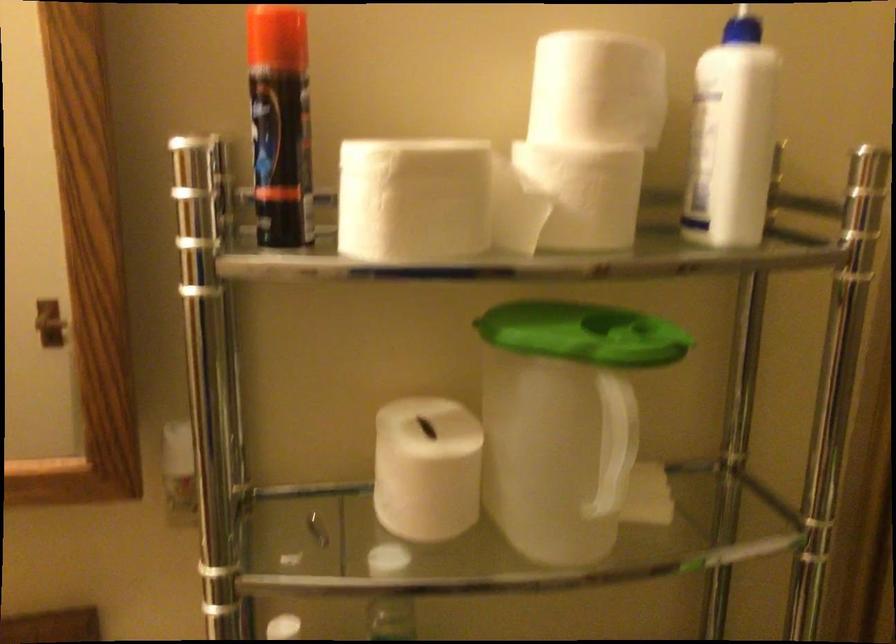
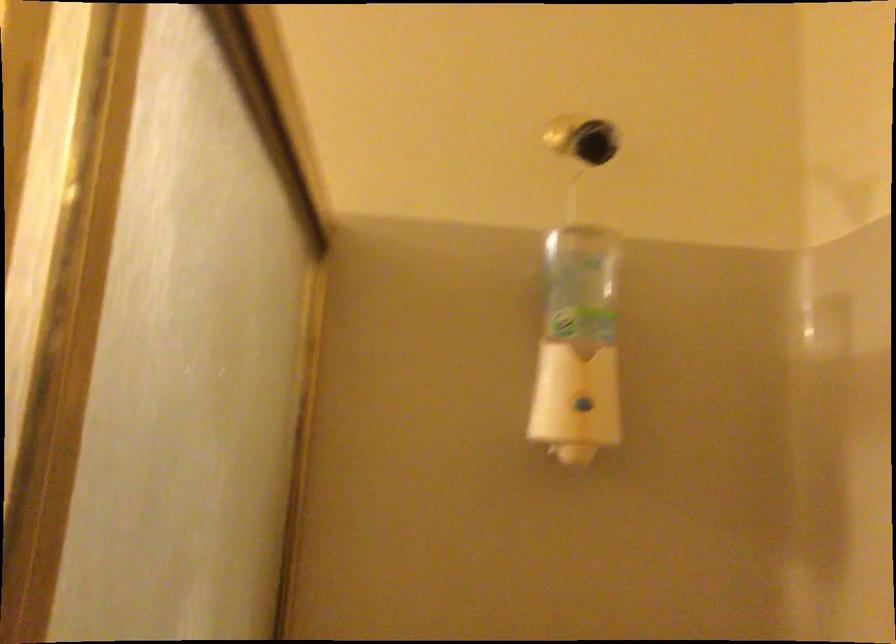
Question: The first image is from the beginning of the video and the second image is from the end. How did the camera likely rotate when shooting the video?

Choices:
 (A) Left
 (B) Right
 (C) Up
 (D) Down

Answer: (C)